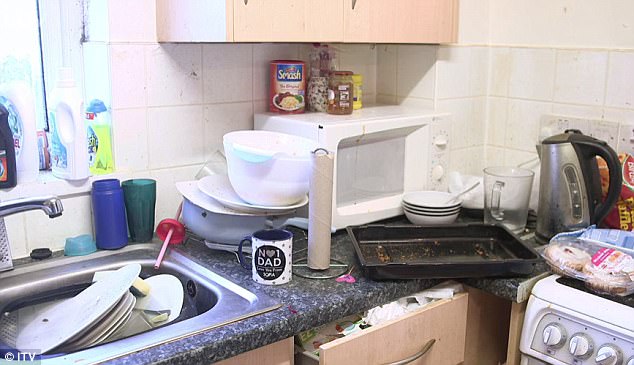
The height and width of the screenshot is (365, 634). What are the coordinates of `metal cooking tray` in the screenshot? It's located at (401, 253).